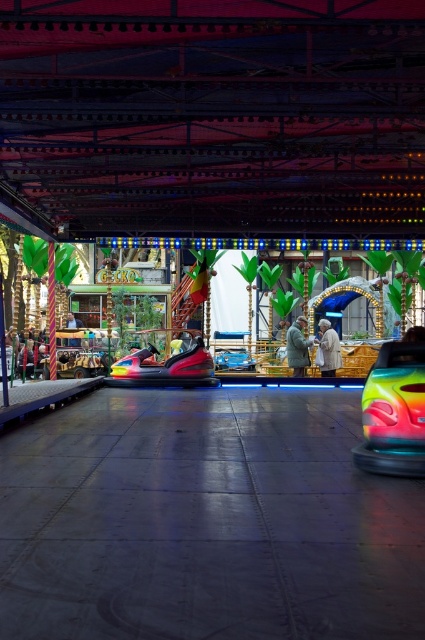
You are standing in the amusement park and see both the shiny metallic bumper car at center and the white fabric coat at center. Which object is positioned to the left?

The shiny metallic bumper car at center is to the left of the white fabric coat at center.

You are a visitor at the amusement park and want to take a photo of the shiny metallic bumper car at center and the white fabric coat at center. Which object should you zoom in on to ensure both fit in the frame without cropping?

The shiny metallic bumper car at center is wider than the white fabric coat at center, so you should zoom out slightly to include both objects in the frame.

You are a visitor at the amusement park and want to know if you can safely place your white fabric coat at center on top of the rainbow plastic bumper car at center without it falling off. Can you do this?

The rainbow plastic bumper car at center is not as tall as the white fabric coat at center. Therefore, placing the white fabric coat at center on top of the bumper car might be unstable because the bumper car is shorter in height compared to the coat, potentially causing it to tip over or slide off.